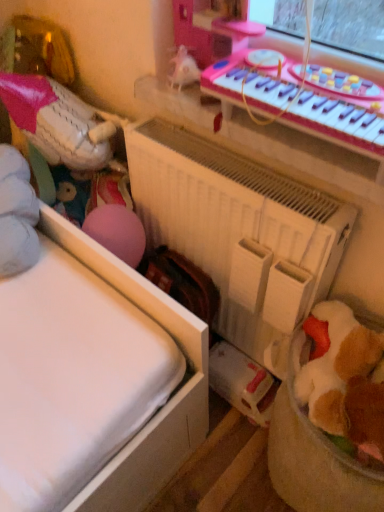
Identify the location of vacant area situated below pink plastic musical keyboard at upper right (from a real-world perspective). This screenshot has height=512, width=384. (294, 147).